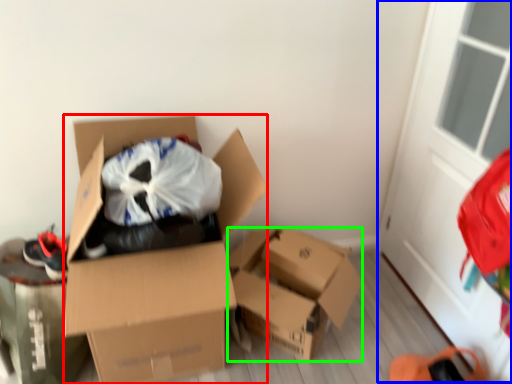
Question: Considering the real-world distances, which object is farthest from box (highlighted by a red box)? screen door (highlighted by a blue box) or box (highlighted by a green box)?

Choices:
 (A) screen door
 (B) box

Answer: (A)